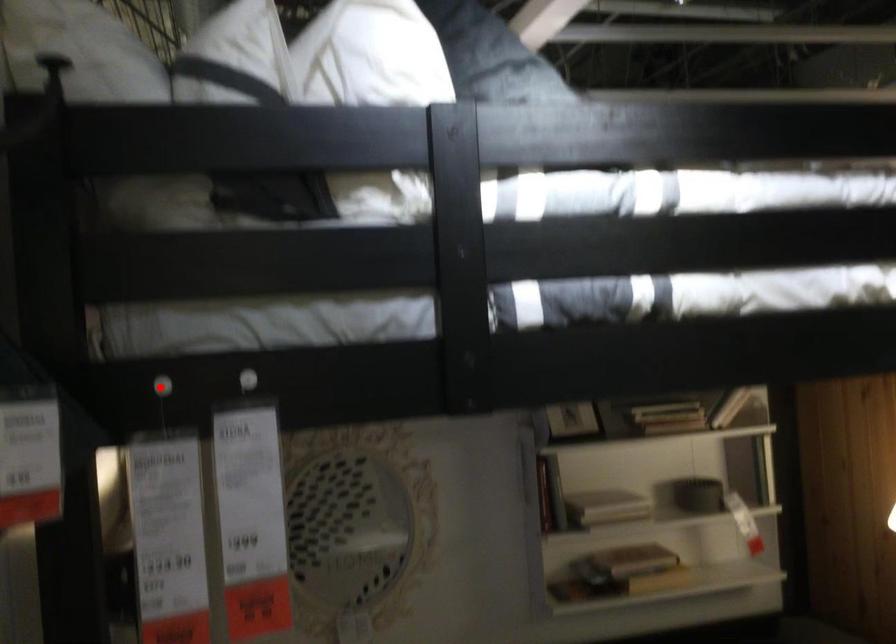
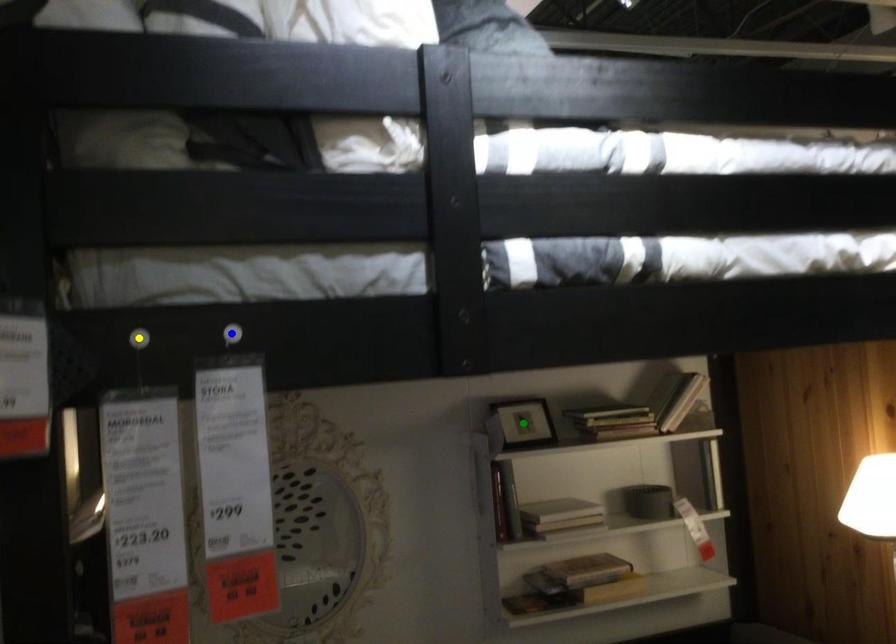
Question: I am providing you with two images of the same scene from different viewpoints. A red point is marked on the first image. You are given multiple points on the second image. Can you choose the point in image 2 that corresponds to the point in image 1?

Choices:
 (A) yellow point
 (B) green point
 (C) blue point

Answer: (A)